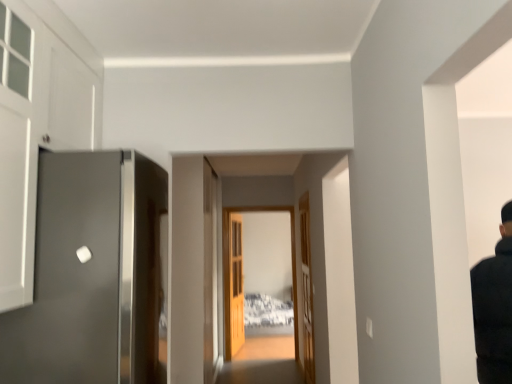
You are a GUI agent. You are given a task and a screenshot of the screen. Output one action in this format:
    pyautogui.click(x=<x>, y=<y>)
    Task: Click on the clear glass door at center
    
    Given the screenshot: What is the action you would take?
    pyautogui.click(x=232, y=269)

Describe the element at coordinates (234, 284) in the screenshot. This screenshot has height=384, width=512. I see `wooden door at center, positioned as the 1th door in back-to-front order` at that location.

What are the coordinates of `clear glass door at center` in the screenshot? It's located at (232, 269).

In the scene shown: Considering the relative positions of clear glass door at center and satin gray door at left, the first door in the left-to-right sequence, in the image provided, is clear glass door at center in front of satin gray door at left, the first door in the left-to-right sequence,?

That is False.

There is a clear glass door at center. Where is `door above it (from a real-world perspective)`? This screenshot has height=384, width=512. door above it (from a real-world perspective) is located at coordinates (91, 274).

How distant is clear glass door at center from satin gray door at left, the first door in the left-to-right sequence?

clear glass door at center is 3.47 meters from satin gray door at left, the first door in the left-to-right sequence.

Can you see clear glass door at center touching satin gray door at left, arranged as the third door when viewed from the right?

clear glass door at center and satin gray door at left, arranged as the third door when viewed from the right, are clearly separated.

Is satin gray door at left, arranged as the third door when viewed from the right, beside wooden door at center, which appears as the second door when viewed from the left?

No, satin gray door at left, arranged as the third door when viewed from the right, is not next to wooden door at center, which appears as the second door when viewed from the left.

Between satin gray door at left, acting as the third door starting from the back, and wooden door at center, which appears as the 3th door when viewed from the front, which one has smaller size?

wooden door at center, which appears as the 3th door when viewed from the front.

Considering the sizes of satin gray door at left, acting as the 1th door starting from the front, and wooden door at center, which ranks as the 2th door in right-to-left order, in the image, is satin gray door at left, acting as the 1th door starting from the front, wider or thinner than wooden door at center, which ranks as the 2th door in right-to-left order,?

Clearly, satin gray door at left, acting as the 1th door starting from the front, has more width compared to wooden door at center, which ranks as the 2th door in right-to-left order.

From a real-world perspective, is satin gray door at left, the first door in the left-to-right sequence, above or below wooden door at center, which appears as the 3th door when viewed from the front?

In terms of real-world spatial position, satin gray door at left, the first door in the left-to-right sequence, is above wooden door at center, which appears as the 3th door when viewed from the front.

How distant is clear glass door at center from wooden door at center, which appears as the second door when viewed from the left?

6.87 inches.

What's the angular difference between clear glass door at center and wooden door at center, which appears as the 3th door when viewed from the front,'s facing directions?

The angle between the facing direction of clear glass door at center and the facing direction of wooden door at center, which appears as the 3th door when viewed from the front, is 81.9 degrees.

Considering the positions of objects clear glass door at center and wooden door at center, positioned as the 1th door in back-to-front order, in the image provided, who is more to the left, clear glass door at center or wooden door at center, positioned as the 1th door in back-to-front order,?

From the viewer's perspective, wooden door at center, positioned as the 1th door in back-to-front order, appears more on the left side.

Does point (237, 211) lie behind point (231, 353)?

No, (237, 211) is in front of (231, 353).

Is wooden door at center, which appears as the 1th door when viewed from the right, to the right of satin gray door at left, the first door in the left-to-right sequence, from the viewer's perspective?

Yes.

From the picture: From a real-world perspective, is wooden door at center, the 2th door positioned from the front, beneath satin gray door at left, acting as the third door starting from the back?

Yes, from a real-world perspective, wooden door at center, the 2th door positioned from the front, is under satin gray door at left, acting as the third door starting from the back.

Which is behind, wooden door at center, acting as the third door starting from the left, or satin gray door at left, acting as the 1th door starting from the front?

wooden door at center, acting as the third door starting from the left, is behind.

Is wooden door at center, the second door when ordered from back to front, situated inside satin gray door at left, acting as the third door starting from the back, or outside?

wooden door at center, the second door when ordered from back to front, is outside satin gray door at left, acting as the third door starting from the back.

From the image's perspective, does clear glass door at center appear lower than wooden door at center, acting as the third door starting from the left?

Yes.

Does clear glass door at center lie behind wooden door at center, acting as the third door starting from the left?

Yes, it is behind wooden door at center, acting as the third door starting from the left.

Considering the sizes of objects clear glass door at center and wooden door at center, the second door when ordered from back to front, in the image provided, who is shorter, clear glass door at center or wooden door at center, the second door when ordered from back to front,?

wooden door at center, the second door when ordered from back to front, is shorter.

Is clear glass door at center placed right next to wooden door at center, the 2th door positioned from the front?

clear glass door at center is not next to wooden door at center, the 2th door positioned from the front, and they're not touching.

Considering the relative sizes of wooden door at center, the 2th door positioned from the front, and clear glass door at center in the image provided, is wooden door at center, the 2th door positioned from the front, wider than clear glass door at center?

No.

The height and width of the screenshot is (384, 512). I want to click on door that is on the right side of clear glass door at center, so click(x=306, y=291).

Is clear glass door at center at the back of wooden door at center, acting as the third door starting from the left?

No, wooden door at center, acting as the third door starting from the left, is not facing the opposite direction of clear glass door at center.

Can you tell me how much satin gray door at left, acting as the third door starting from the back, and clear glass door at center differ in facing direction?

There is a 91-degree angle between the facing directions of satin gray door at left, acting as the third door starting from the back, and clear glass door at center.

Between satin gray door at left, acting as the third door starting from the back, and clear glass door at center, which one has smaller size?

clear glass door at center is smaller.

Is point (127, 271) closer or farther from the camera than point (292, 222)?

Point (127, 271) is closer to the camera than point (292, 222).

Is satin gray door at left, acting as the 1th door starting from the front, positioned with its back to clear glass door at center?

No, satin gray door at left, acting as the 1th door starting from the front,'s orientation is not away from clear glass door at center.

You are a GUI agent. You are given a task and a screenshot of the screen. Output one action in this format:
    pyautogui.click(x=<x>, y=<y>)
    Task: Click on the glass door below the satin gray door at left, the first door in the left-to-right sequence (from a real-world perspective)
    The width and height of the screenshot is (512, 384).
    Given the screenshot: What is the action you would take?
    pyautogui.click(x=232, y=269)

From the image's perspective, which door is the 2nd one below the satin gray door at left, the first door in the left-to-right sequence? Please provide its 2D coordinates.

[(234, 284)]

Looking at the image, which one is located closer to clear glass door at center, wooden door at center, positioned as the 1th door in back-to-front order, or satin gray door at left, acting as the 1th door starting from the front?

wooden door at center, positioned as the 1th door in back-to-front order, is closer to clear glass door at center.

Based on their spatial positions, is satin gray door at left, acting as the third door starting from the back, or wooden door at center, the 2th door positioned from the front, closer to wooden door at center, positioned as the 1th door in back-to-front order?

Based on the image, wooden door at center, the 2th door positioned from the front, appears to be nearer to wooden door at center, positioned as the 1th door in back-to-front order.

Based on their spatial positions, is satin gray door at left, acting as the third door starting from the back, or wooden door at center, acting as the third door starting from the left, further from clear glass door at center?

satin gray door at left, acting as the third door starting from the back, lies further to clear glass door at center than the other object.

Based on their spatial positions, is wooden door at center, which appears as the 3th door when viewed from the front, or satin gray door at left, the first door in the left-to-right sequence, further from wooden door at center, the second door when ordered from back to front?

satin gray door at left, the first door in the left-to-right sequence, lies further to wooden door at center, the second door when ordered from back to front, than the other object.

Estimate the real-world distances between objects in this image. Which object is further from wooden door at center, acting as the third door starting from the left, satin gray door at left, acting as the third door starting from the back, or clear glass door at center?

satin gray door at left, acting as the third door starting from the back.

Considering their positions, is satin gray door at left, acting as the third door starting from the back, positioned closer to wooden door at center, the second door when ordered from back to front, than wooden door at center, which appears as the second door when viewed from the left?

Based on the image, wooden door at center, which appears as the second door when viewed from the left, appears to be nearer to wooden door at center, the second door when ordered from back to front.

Estimate the real-world distances between objects in this image. Which object is closer to wooden door at center, which appears as the 3th door when viewed from the front, satin gray door at left, acting as the 1th door starting from the front, or clear glass door at center?

clear glass door at center is positioned closer to the anchor wooden door at center, which appears as the 3th door when viewed from the front.

When comparing their distances from wooden door at center, which appears as the 3th door when viewed from the front, does wooden door at center, the 2th door positioned from the front, or satin gray door at left, the first door in the left-to-right sequence, seem closer?

wooden door at center, the 2th door positioned from the front, is positioned closer to the anchor wooden door at center, which appears as the 3th door when viewed from the front.

Find the location of a particular element. This screenshot has height=384, width=512. glass door between satin gray door at left, the first door in the left-to-right sequence, and wooden door at center, which ranks as the 2th door in right-to-left order, in the front-back direction is located at coordinates (232, 269).

You are a GUI agent. You are given a task and a screenshot of the screen. Output one action in this format:
    pyautogui.click(x=<x>, y=<y>)
    Task: Click on the glass door between wooden door at center, acting as the third door starting from the left, and wooden door at center, which ranks as the 2th door in right-to-left order, along the z-axis
    
    Given the screenshot: What is the action you would take?
    coord(232,269)

You are a GUI agent. You are given a task and a screenshot of the screen. Output one action in this format:
    pyautogui.click(x=<x>, y=<y>)
    Task: Click on the door between satin gray door at left, arranged as the third door when viewed from the right, and clear glass door at center from front to back
    The height and width of the screenshot is (384, 512).
    Given the screenshot: What is the action you would take?
    pyautogui.click(x=306, y=291)

Locate an element on the screen. door positioned between satin gray door at left, acting as the 1th door starting from the front, and wooden door at center, positioned as the 1th door in back-to-front order, from near to far is located at coordinates (306, 291).